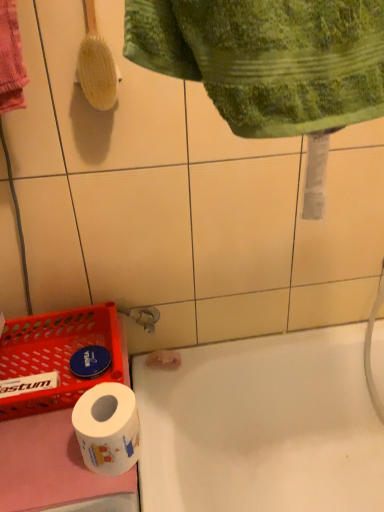
The height and width of the screenshot is (512, 384). Find the location of `vacant point to the left of white glossy toilet paper at lower left`. vacant point to the left of white glossy toilet paper at lower left is located at coordinates (42, 454).